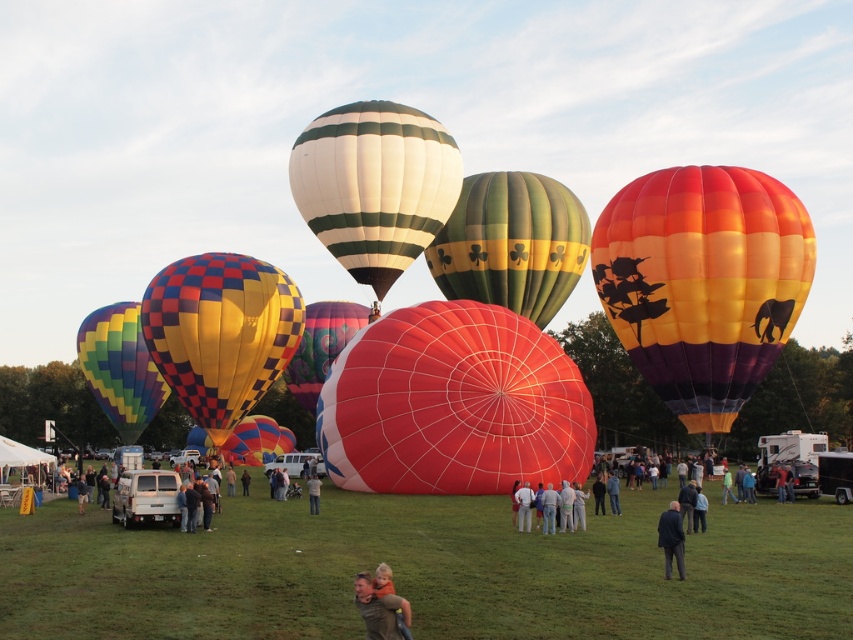
What are the coordinates of `white striped balloon at center` in the screenshot? It's located at click(x=374, y=186).

Is white striped balloon at center taller than light brown leather jacket at center?

Yes.

Which is in front, point (450, 157) or point (309, 508)?

Point (309, 508)

This screenshot has width=853, height=640. Find the location of `white striped balloon at center`. white striped balloon at center is located at coordinates (374, 186).

Between point (587, 236) and point (109, 372), which one is positioned behind?

The point (109, 372) is more distant.

Which is more to the left, green striped balloon at center or multicolored fabric balloon at left?

multicolored fabric balloon at left is more to the left.

Which is behind, point (453, 273) or point (125, 369)?

The point (125, 369) is behind.

Image resolution: width=853 pixels, height=640 pixels. Identify the location of green striped balloon at center. (511, 243).

Is matte red balloon at center in front of smooth skin man holding child at center?

No, it is behind smooth skin man holding child at center.

The height and width of the screenshot is (640, 853). I want to click on matte red balloon at center, so click(x=453, y=404).

Where is `matte red balloon at center`? Image resolution: width=853 pixels, height=640 pixels. matte red balloon at center is located at coordinates (453, 404).